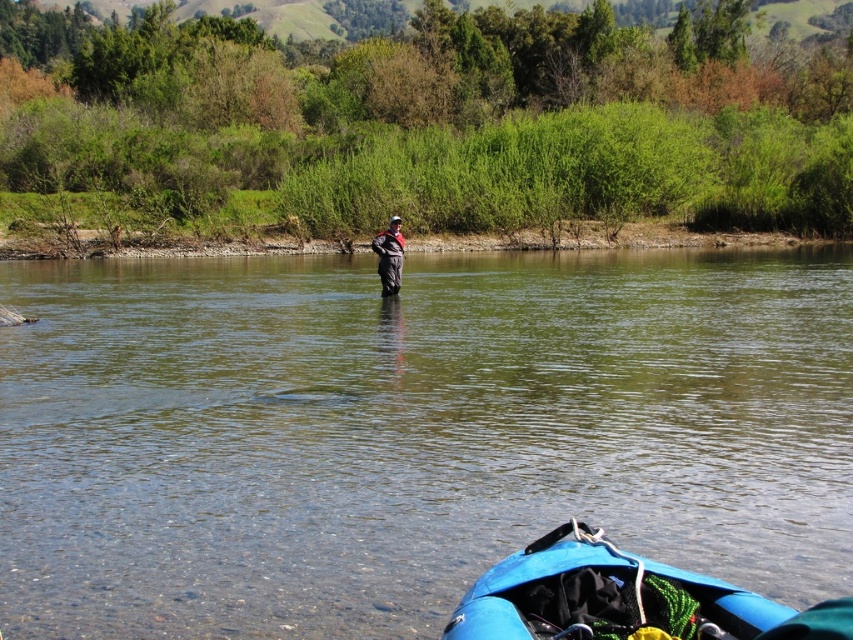
Question: Which object is positioned farthest from the dark gray waterproof jacket at center?

Choices:
 (A) clear water at center
 (B) blue rubber canoe at lower center

Answer: (B)

Question: Which object is farther from the camera taking this photo?

Choices:
 (A) dark gray waterproof jacket at center
 (B) blue rubber canoe at lower center
 (C) clear water at center

Answer: (A)

Question: Is clear water at center below dark gray waterproof jacket at center?

Choices:
 (A) no
 (B) yes

Answer: (B)

Question: Observing the image, what is the correct spatial positioning of blue rubber canoe at lower center in reference to dark gray waterproof jacket at center?

Choices:
 (A) below
 (B) above

Answer: (A)

Question: Considering the relative positions of clear water at center and dark gray waterproof jacket at center in the image provided, where is clear water at center located with respect to dark gray waterproof jacket at center?

Choices:
 (A) below
 (B) above

Answer: (A)

Question: Which point is closer to the camera?

Choices:
 (A) dark gray waterproof jacket at center
 (B) blue rubber canoe at lower center

Answer: (B)